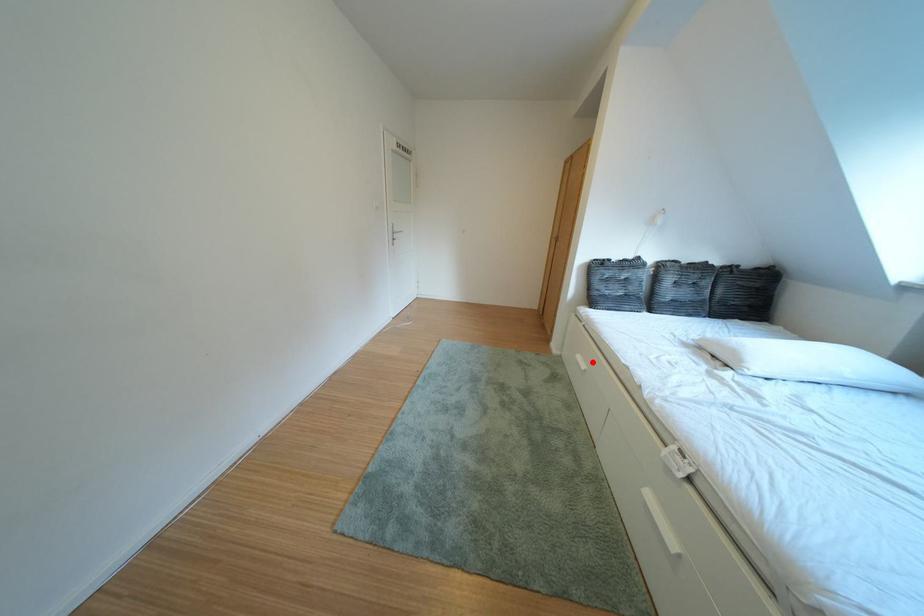
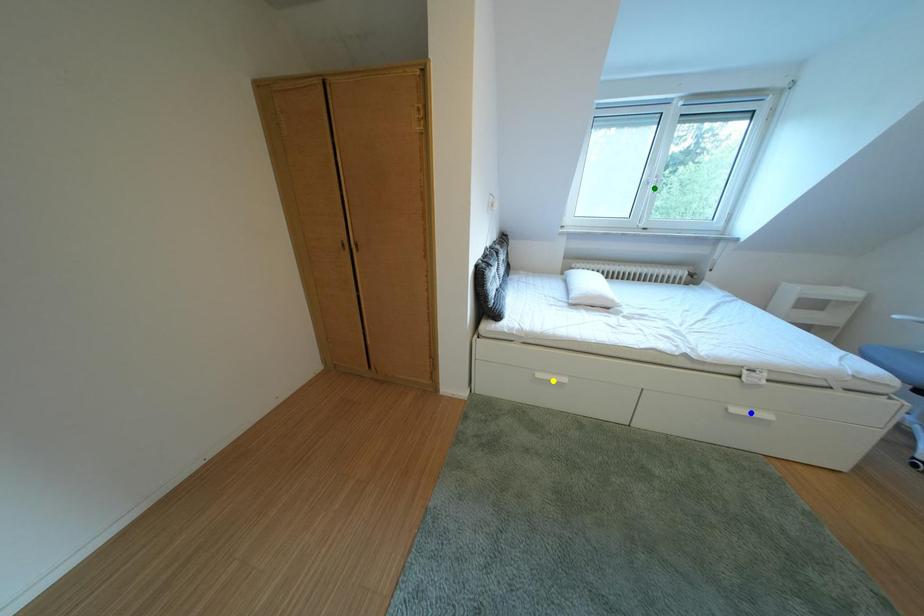
Question: I am providing you with two images of the same scene from different viewpoints. A red point is marked on the first image. You are given multiple points on the second image. Which point in image 2 represents the same 3d spot as the red point in image 1?

Choices:
 (A) yellow point
 (B) blue point
 (C) green point

Answer: (A)